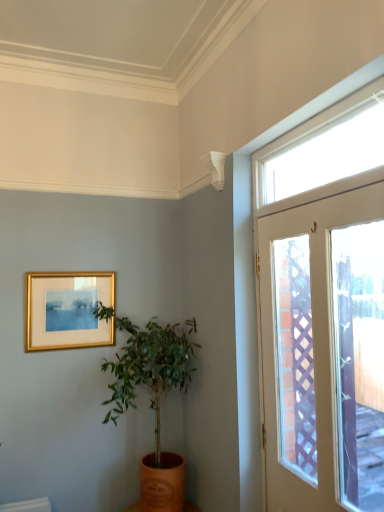
Question: From a real-world perspective, is orange clay pot at center physically located above or below gold metallic picture frame at upper left?

Choices:
 (A) below
 (B) above

Answer: (A)

Question: Relative to gold metallic picture frame at upper left, is orange clay pot at center in front or behind?

Choices:
 (A) front
 (B) behind

Answer: (A)

Question: Estimate the real-world distances between objects in this image. Which object is farther from the orange clay pot at center?

Choices:
 (A) gold metallic picture frame at upper left
 (B) clear glass window at upper right
 (C) white glossy door at right

Answer: (B)

Question: Which object is positioned closest to the gold metallic picture frame at upper left?

Choices:
 (A) clear glass window at upper right
 (B) white glossy door at right
 (C) orange clay pot at center

Answer: (C)